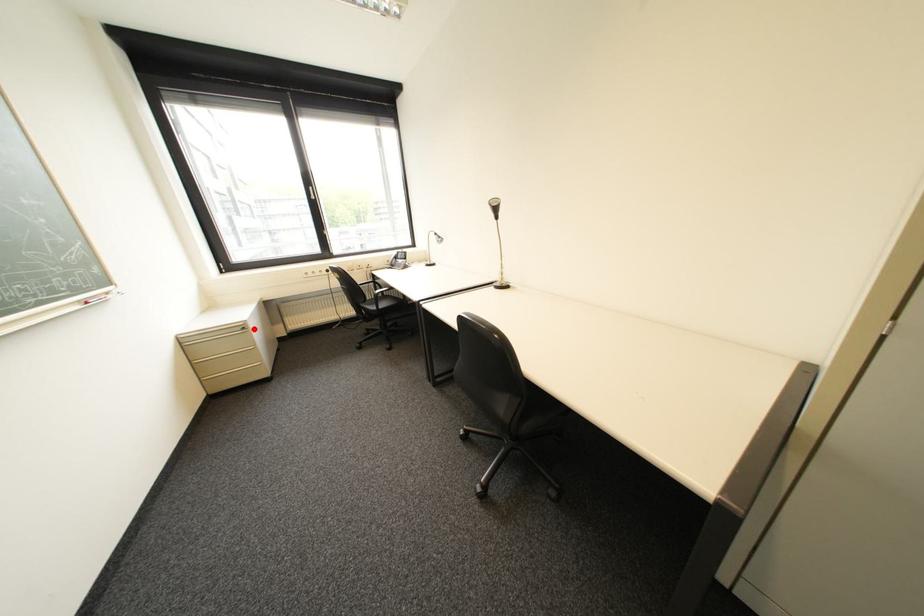
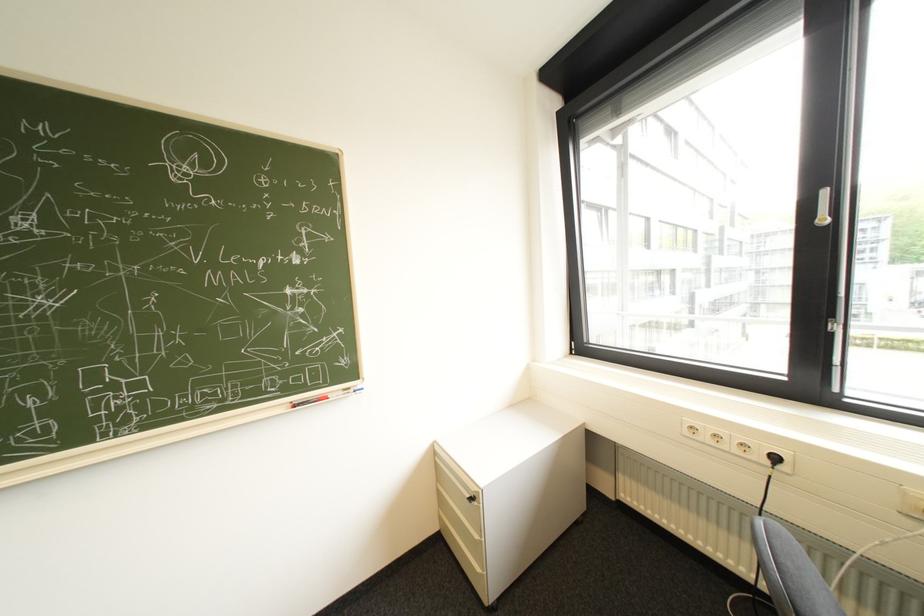
Question: I am providing you with two images of the same scene from different viewpoints. Image1 has a red point marked. In image2, the corresponding 3D location appears at what relative position? Reply with the corresponding letter.

Choices:
 (A) Closer
 (B) Farther

Answer: (B)